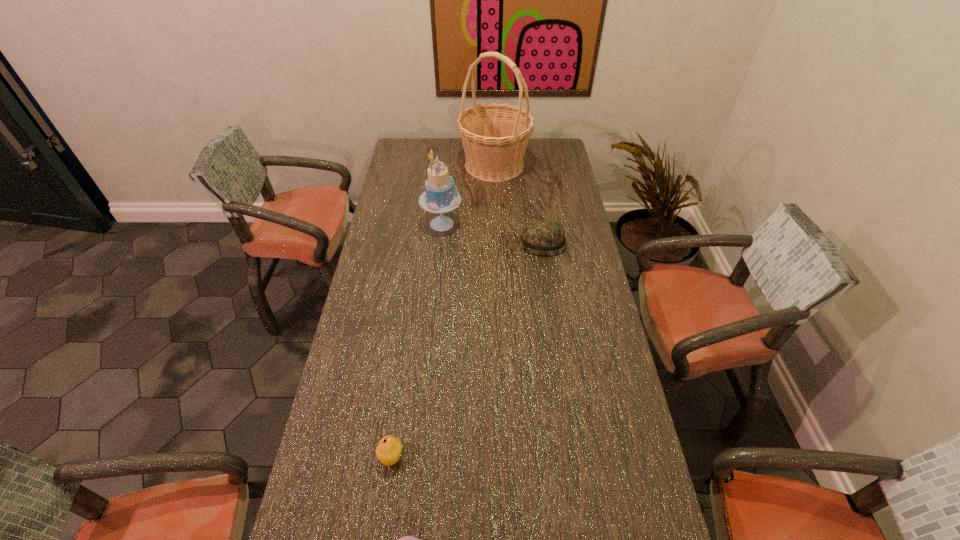
Find the location of `the tallest object`. the tallest object is located at coordinates (494, 135).

In order to click on the farthest object in this screenshot , I will do `click(494, 135)`.

The width and height of the screenshot is (960, 540). Find the location of `the fourth shortest object`. the fourth shortest object is located at coordinates (440, 196).

Find the location of a particular element. The image size is (960, 540). headwear is located at coordinates (540, 237).

This screenshot has height=540, width=960. I want to click on the second nearest object, so click(388, 452).

Image resolution: width=960 pixels, height=540 pixels. Find the location of `free spot located on the left of the farthest object`. free spot located on the left of the farthest object is located at coordinates (408, 165).

Locate an element on the screen. vacant space located with a ladder on the side of the second tallest object is located at coordinates (522, 224).

Image resolution: width=960 pixels, height=540 pixels. In order to click on free space located on the back of the headwear in this screenshot , I will do `click(540, 222)`.

Locate an element on the screen. The height and width of the screenshot is (540, 960). vacant space located on the back of the second nearest object is located at coordinates (408, 340).

This screenshot has height=540, width=960. Find the location of `object positioned at the far edge`. object positioned at the far edge is located at coordinates (494, 135).